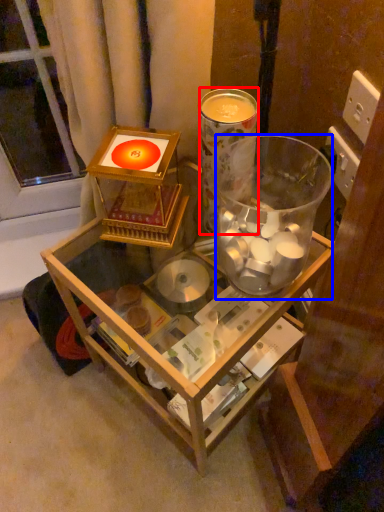
Question: Among these objects, which one is nearest to the camera, beverage (highlighted by a red box) or beverage (highlighted by a blue box)?

Choices:
 (A) beverage
 (B) beverage

Answer: (B)